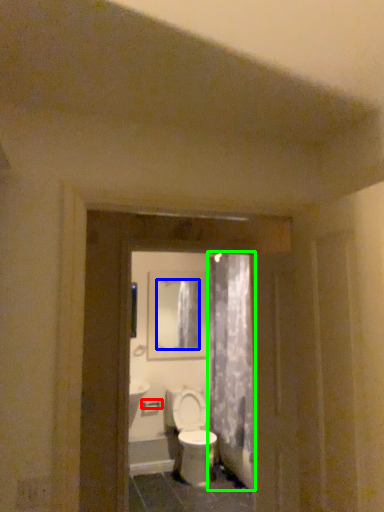
Question: Which object is positioned closest to door handle (highlighted by a red box)? Select from mirror (highlighted by a blue box) and shower curtain (highlighted by a green box).

Choices:
 (A) mirror
 (B) shower curtain

Answer: (A)